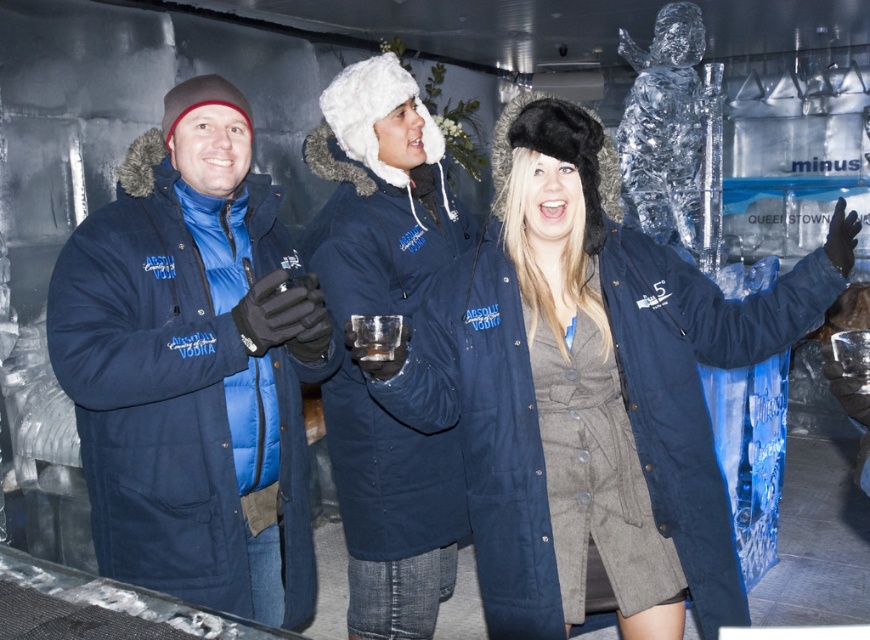
Who is positioned more to the right, matte blue coat at left or navy blue parka at center?

From the viewer's perspective, navy blue parka at center appears more on the right side.

Which is in front, point (155, 573) or point (640, 356)?

Point (640, 356)

At what (x,y) coordinates should I click in order to perform the action: click on matte blue coat at left. Please return your answer as a coordinate pair (x, y). Looking at the image, I should click on (193, 368).